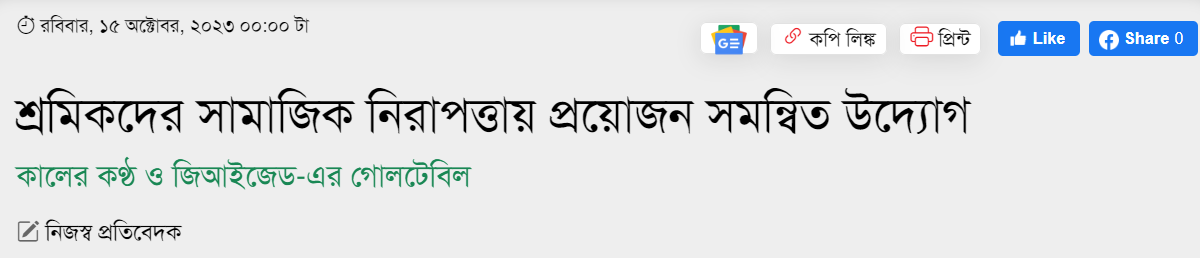
The height and width of the screenshot is (258, 1200). In order to click on black clock in this screenshot , I will do `click(24, 24)`.